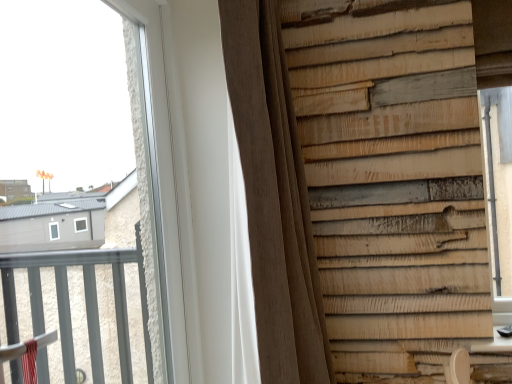
What do you see at coordinates (144, 138) in the screenshot?
I see `transparent glass window at upper left` at bounding box center [144, 138].

In order to face transparent glass window at upper left, should I rotate leftwards or rightwards?

To align with it, rotate left about 16.927°.

Where is `transparent glass window at upper left`? The image size is (512, 384). transparent glass window at upper left is located at coordinates (144, 138).

Find the location of a particular element. The height and width of the screenshot is (384, 512). brown textured curtain at center is located at coordinates (274, 198).

The width and height of the screenshot is (512, 384). Describe the element at coordinates (274, 198) in the screenshot. I see `brown textured curtain at center` at that location.

You are a GUI agent. You are given a task and a screenshot of the screen. Output one action in this format:
    pyautogui.click(x=<x>, y=<y>)
    Task: Click on the transparent glass window at upper left
    The height and width of the screenshot is (384, 512).
    Given the screenshot: What is the action you would take?
    pyautogui.click(x=144, y=138)

Considering the relative positions of brown textured curtain at center and transparent glass window at upper left in the image provided, is brown textured curtain at center to the right of transparent glass window at upper left from the viewer's perspective?

Yes, brown textured curtain at center is to the right of transparent glass window at upper left.

Which object is further away from the camera, brown textured curtain at center or transparent glass window at upper left?

brown textured curtain at center is more distant.

Does point (278, 378) lie in front of point (134, 28)?

That is True.

From the image's perspective, is brown textured curtain at center above or below transparent glass window at upper left?

From the image's perspective, brown textured curtain at center appears below transparent glass window at upper left.

From a real-world perspective, is brown textured curtain at center positioned under transparent glass window at upper left based on gravity?

Correct, in the physical world, brown textured curtain at center is lower than transparent glass window at upper left.

Considering the relative sizes of brown textured curtain at center and transparent glass window at upper left in the image provided, is brown textured curtain at center thinner than transparent glass window at upper left?

In fact, brown textured curtain at center might be wider than transparent glass window at upper left.

Does brown textured curtain at center have a greater height compared to transparent glass window at upper left?

Correct, brown textured curtain at center is much taller as transparent glass window at upper left.

Can you confirm if brown textured curtain at center is bigger than transparent glass window at upper left?

Indeed, brown textured curtain at center has a larger size compared to transparent glass window at upper left.

Would you say brown textured curtain at center contains transparent glass window at upper left?

No, transparent glass window at upper left is not a part of brown textured curtain at center.

Is brown textured curtain at center far from transparent glass window at upper left?

They are positioned close to each other.

Is brown textured curtain at center oriented away from transparent glass window at upper left?

No, brown textured curtain at center is not facing the opposite direction of transparent glass window at upper left.

Identify the location of window above the brown textured curtain at center (from a real-world perspective). Image resolution: width=512 pixels, height=384 pixels. (144, 138).

Considering the relative positions of transparent glass window at upper left and brown textured curtain at center in the image provided, is transparent glass window at upper left to the left of brown textured curtain at center from the viewer's perspective?

Yes, transparent glass window at upper left is to the left of brown textured curtain at center.

Based on the photo, which object is further away from the camera taking this photo, transparent glass window at upper left or brown textured curtain at center?

brown textured curtain at center is further away from the camera.

Does point (162, 306) appear closer or farther from the camera than point (243, 17)?

Point (162, 306) is positioned farther from the camera compared to point (243, 17).

From the image's perspective, which one is positioned lower, transparent glass window at upper left or brown textured curtain at center?

brown textured curtain at center.

From a real-world perspective, is transparent glass window at upper left under brown textured curtain at center?

Actually, transparent glass window at upper left is physically above brown textured curtain at center in the real world.

Can you confirm if transparent glass window at upper left is wider than brown textured curtain at center?

No.

Between transparent glass window at upper left and brown textured curtain at center, which one has more height?

Standing taller between the two is brown textured curtain at center.

Does transparent glass window at upper left have a smaller size compared to brown textured curtain at center?

Correct, transparent glass window at upper left occupies less space than brown textured curtain at center.

Does transparent glass window at upper left contain brown textured curtain at center?

No, brown textured curtain at center is not inside transparent glass window at upper left.

Are transparent glass window at upper left and brown textured curtain at center beside each other?

transparent glass window at upper left and brown textured curtain at center are not in contact.

Is transparent glass window at upper left facing towards brown textured curtain at center?

Yes, transparent glass window at upper left is turned towards brown textured curtain at center.

From the picture: What's the angular difference between transparent glass window at upper left and brown textured curtain at center's facing directions?

The angle between the facing direction of transparent glass window at upper left and the facing direction of brown textured curtain at center is 6.89 degrees.

How much distance is there between transparent glass window at upper left and brown textured curtain at center?

They are 16.47 inches apart.

This screenshot has width=512, height=384. I want to click on curtain lying on the right of transparent glass window at upper left, so click(x=274, y=198).

I want to click on window that appears above the brown textured curtain at center (from the image's perspective), so [144, 138].

The width and height of the screenshot is (512, 384). I want to click on window on the left of brown textured curtain at center, so click(x=144, y=138).